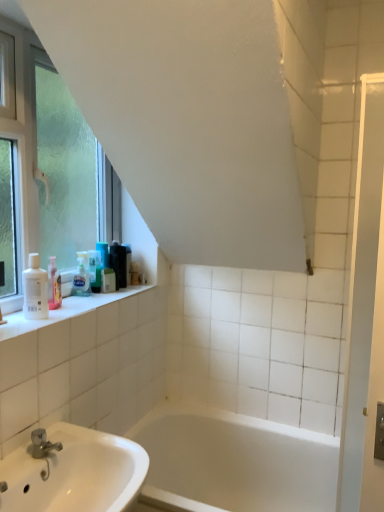
Describe the element at coordinates (234, 462) in the screenshot. I see `white glossy bathtub at center` at that location.

This screenshot has width=384, height=512. What do you see at coordinates (108, 280) in the screenshot?
I see `translucent plastic bottle at upper left, which is the third toiletry from back to front` at bounding box center [108, 280].

In order to face black plastic container at upper left, the first toiletry positioned from the back, should I rotate leftwards or rightwards?

It's best to rotate left around 8.776 degrees.

The height and width of the screenshot is (512, 384). What do you see at coordinates (365, 314) in the screenshot?
I see `white glossy screen door at right` at bounding box center [365, 314].

Image resolution: width=384 pixels, height=512 pixels. Identify the location of translucent plastic bottle at upper left, acting as the 4th toiletry starting from the back. (95, 270).

Can you confirm if white matte lotion at left, which is the 1th toiletry from front to back, is smaller than clear plastic soap dispenser at upper left, which is the 2th toiletry in front-to-back order?

Actually, white matte lotion at left, which is the 1th toiletry from front to back, might be larger than clear plastic soap dispenser at upper left, which is the 2th toiletry in front-to-back order.

In the image, is white matte lotion at left, acting as the sixth toiletry starting from the back, positioned in front of or behind clear plastic soap dispenser at upper left, the 5th toiletry when ordered from back to front?

In the image, white matte lotion at left, acting as the sixth toiletry starting from the back, appears in front of clear plastic soap dispenser at upper left, the 5th toiletry when ordered from back to front.

From a real-world perspective, is white matte lotion at left, which is the 1th toiletry from front to back, located beneath clear plastic soap dispenser at upper left, which is the 2th toiletry in front-to-back order?

No, from a real-world perspective, white matte lotion at left, which is the 1th toiletry from front to back, is not beneath clear plastic soap dispenser at upper left, which is the 2th toiletry in front-to-back order.

From the image's perspective, between white matte lotion at left, which is the 1th toiletry from front to back, and clear plastic soap dispenser at upper left, the 5th toiletry when ordered from back to front, who is located below?

white matte lotion at left, which is the 1th toiletry from front to back, appears lower in the image.

Based on the photo, measure the distance between translucent plastic bottle at upper left, which is the third toiletry from back to front, and white glossy screen door at right.

A distance of 3.69 feet exists between translucent plastic bottle at upper left, which is the third toiletry from back to front, and white glossy screen door at right.

From the image's perspective, is translucent plastic bottle at upper left, which is the third toiletry from back to front, above or below white glossy screen door at right?

Based on their image positions, translucent plastic bottle at upper left, which is the third toiletry from back to front, is located above white glossy screen door at right.

Looking at this image, which of these two, translucent plastic bottle at upper left, which ranks as the 4th toiletry in front-to-back order, or white glossy screen door at right, is thinner?

translucent plastic bottle at upper left, which ranks as the 4th toiletry in front-to-back order.

Does translucent plastic bottle at upper left, which ranks as the 4th toiletry in front-to-back order, have a lesser height compared to white glossy screen door at right?

Correct, translucent plastic bottle at upper left, which ranks as the 4th toiletry in front-to-back order, is not as tall as white glossy screen door at right.

Does translucent plastic bottle at upper left, which ranks as the 4th toiletry in front-to-back order, turn towards white matte lotion at left, which is the 1th toiletry from front to back?

No, translucent plastic bottle at upper left, which ranks as the 4th toiletry in front-to-back order, is not oriented towards white matte lotion at left, which is the 1th toiletry from front to back.

Which of these two, translucent plastic bottle at upper left, which ranks as the 4th toiletry in front-to-back order, or white matte lotion at left, which is the 1th toiletry from front to back, stands taller?

white matte lotion at left, which is the 1th toiletry from front to back, is taller.

Is point (108, 278) less distant than point (32, 286)?

No.

You are a GUI agent. You are given a task and a screenshot of the screen. Output one action in this format:
    pyautogui.click(x=<x>, y=<y>)
    Task: Click on the 5th toiletry located above the translucent plastic bottle at upper left, which is the third toiletry from back to front (from a real-world perspective)
    
    Given the screenshot: What is the action you would take?
    pyautogui.click(x=35, y=290)

Which point is more forward, (25, 177) or (126, 268)?

Positioned in front is point (25, 177).

From their relative heights in the image, would you say frosted glass window at left is taller or shorter than translucent plastic bottles at upper left, the fifth toiletry when ordered from front to back?

frosted glass window at left is taller than translucent plastic bottles at upper left, the fifth toiletry when ordered from front to back.

At what (x,y) coordinates should I click in order to perform the action: click on toiletry that is the 2nd one below the frosted glass window at left (from a real-world perspective). Please return your answer as a coordinate pair (x, y). This screenshot has height=512, width=384. Looking at the image, I should click on (119, 264).

Is frosted glass window at left aimed at translucent plastic bottle at upper left, which is the third toiletry from back to front?

Yes, frosted glass window at left is facing translucent plastic bottle at upper left, which is the third toiletry from back to front.

Find the location of `window that is above the translucent plastic bottle at upper left, which is the third toiletry from back to front (from a real-world perspective)`. window that is above the translucent plastic bottle at upper left, which is the third toiletry from back to front (from a real-world perspective) is located at coordinates (24, 134).

Would you say frosted glass window at left is inside or outside translucent plastic bottle at upper left, which is the third toiletry from back to front?

The correct answer is: outside.

Is white glossy screen door at right at the left side of translucent plastic bottles at upper left, the second toiletry viewed from the back?

Incorrect, white glossy screen door at right is not on the left side of translucent plastic bottles at upper left, the second toiletry viewed from the back.

Which is farther, (365, 127) or (119, 269)?

Point (119, 269)

From a real-world perspective, which is physically below, white glossy screen door at right or translucent plastic bottles at upper left, the fifth toiletry when ordered from front to back?

From a 3D spatial view, translucent plastic bottles at upper left, the fifth toiletry when ordered from front to back, is below.

Considering the relative sizes of white glossy screen door at right and translucent plastic bottles at upper left, the second toiletry viewed from the back, in the image provided, is white glossy screen door at right thinner than translucent plastic bottles at upper left, the second toiletry viewed from the back,?

Correct, the width of white glossy screen door at right is less than that of translucent plastic bottles at upper left, the second toiletry viewed from the back.

Which of these two, translucent plastic bottles at upper left, the second toiletry viewed from the back, or frosted glass window at left, is bigger?

With larger size is frosted glass window at left.

Could you tell me if translucent plastic bottles at upper left, the second toiletry viewed from the back, is facing frosted glass window at left?

No.

From the image's perspective, is translucent plastic bottles at upper left, the fifth toiletry when ordered from front to back, positioned above or below frosted glass window at left?

translucent plastic bottles at upper left, the fifth toiletry when ordered from front to back, is below frosted glass window at left.

Between translucent plastic bottles at upper left, the fifth toiletry when ordered from front to back, and frosted glass window at left, which one appears on the right side from the viewer's perspective?

translucent plastic bottles at upper left, the fifth toiletry when ordered from front to back.

I want to click on toiletry that is the 1st one when counting downward from the clear plastic soap dispenser at upper left, which is the 2th toiletry in front-to-back order (from the image's perspective), so tap(35, 290).

Identify the location of the 4th toiletry behind the white glossy screen door at right. The width and height of the screenshot is (384, 512). (108, 280).

Based on their spatial positions, is translucent plastic bottles at upper left, the second toiletry viewed from the back, or clear plastic soap dispenser at upper left, which is the 2th toiletry in front-to-back order, closer to white glossy bathtub at center?

translucent plastic bottles at upper left, the second toiletry viewed from the back, is closer to white glossy bathtub at center.

From the image, which object appears to be farther from white matte lotion at left, which is the 1th toiletry from front to back, black plastic container at upper left, the 6th toiletry positioned from the front, or white glossy screen door at right?

white glossy screen door at right is positioned further to the anchor white matte lotion at left, which is the 1th toiletry from front to back.

Looking at this image, looking at the image, which one is located closer to white glossy screen door at right, black plastic container at upper left, the first toiletry positioned from the back, or translucent plastic bottle at upper left, acting as the 4th toiletry starting from the back?

Among the two, translucent plastic bottle at upper left, acting as the 4th toiletry starting from the back, is located nearer to white glossy screen door at right.

Considering their positions, is translucent plastic bottle at upper left, which is the third toiletry from back to front, positioned closer to white matte lotion at left, which is the 1th toiletry from front to back, than white glossy bathtub at center?

translucent plastic bottle at upper left, which is the third toiletry from back to front.

Estimate the real-world distances between objects in this image. Which object is closer to white glossy bathtub at center, clear plastic soap dispenser at upper left, which is the 2th toiletry in front-to-back order, or translucent plastic bottle at upper left, acting as the 4th toiletry starting from the back?

Among the two, translucent plastic bottle at upper left, acting as the 4th toiletry starting from the back, is located nearer to white glossy bathtub at center.

Estimate the real-world distances between objects in this image. Which object is closer to white glossy bathtub at center, clear plastic soap dispenser at upper left, the 5th toiletry when ordered from back to front, or white matte lotion at left, acting as the sixth toiletry starting from the back?

clear plastic soap dispenser at upper left, the 5th toiletry when ordered from back to front.

In the scene shown: Which object lies nearer to the anchor point white matte lotion at left, which is the 1th toiletry from front to back, black plastic container at upper left, the first toiletry positioned from the back, or frosted glass window at left?

Based on the image, frosted glass window at left appears to be nearer to white matte lotion at left, which is the 1th toiletry from front to back.

When comparing their distances from white matte lotion at left, which is the 1th toiletry from front to back, does translucent plastic bottle at upper left, the third toiletry from the front, or white glossy bathtub at center seem closer?

translucent plastic bottle at upper left, the third toiletry from the front, is closer to white matte lotion at left, which is the 1th toiletry from front to back.

I want to click on screen door that lies between translucent plastic bottles at upper left, the fifth toiletry when ordered from front to back, and white glossy bathtub at center from top to bottom, so click(x=365, y=314).

Identify the location of toiletry between white matte lotion at left, which is the 1th toiletry from front to back, and translucent plastic bottle at upper left, acting as the 4th toiletry starting from the back, in the front-back direction. (82, 276).

Find the location of `toiletry located between translucent plastic bottle at upper left, acting as the 4th toiletry starting from the back, and translucent plastic bottles at upper left, the fifth toiletry when ordered from front to back, in the depth direction`. toiletry located between translucent plastic bottle at upper left, acting as the 4th toiletry starting from the back, and translucent plastic bottles at upper left, the fifth toiletry when ordered from front to back, in the depth direction is located at coordinates (108, 280).

At what (x,y) coordinates should I click in order to perform the action: click on toiletry between clear plastic soap dispenser at upper left, the 5th toiletry when ordered from back to front, and translucent plastic bottle at upper left, which ranks as the 4th toiletry in front-to-back order, in the horizontal direction. Please return your answer as a coordinate pair (x, y). The width and height of the screenshot is (384, 512). Looking at the image, I should click on (95, 270).